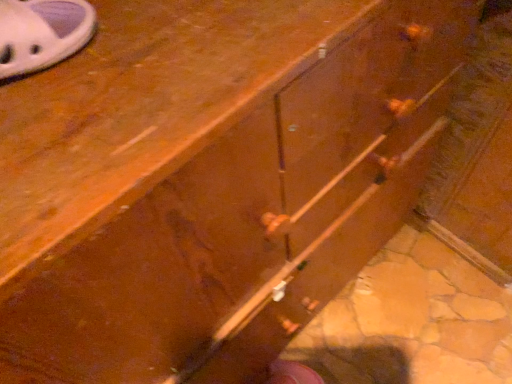
Locate an element on the screen. vacant area to the right of white fabric shoe at upper left is located at coordinates (141, 75).